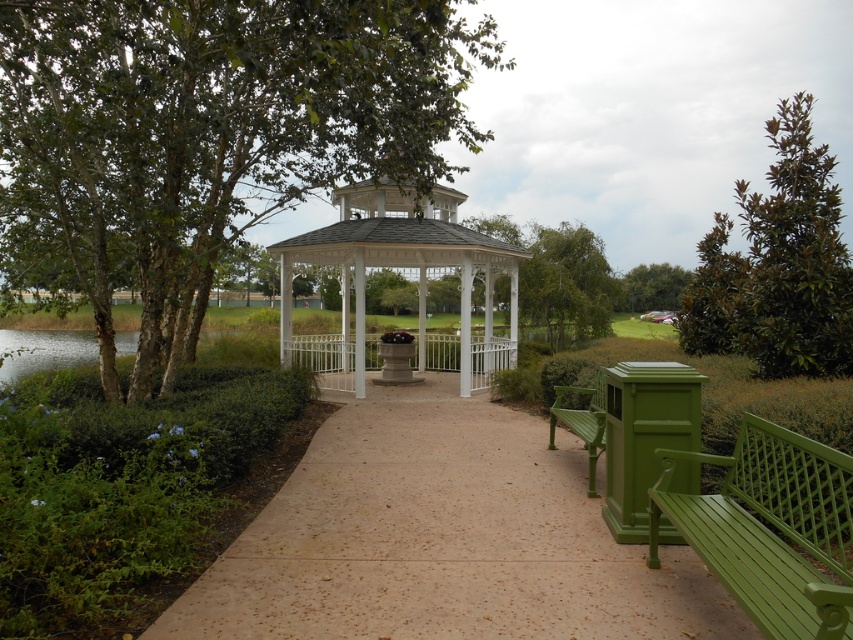
You are a park visitor standing at the entrance of the park. You see the white painted metal gazebo at center and the green leafy tree at center. Which object is positioned higher in the image?

The white painted metal gazebo at center is positioned higher than the green leafy tree at center in the image.

You are standing at the entrance of the park and see the green leafy tree at upper left and the green leafy tree at center. Which tree is closer to you?

The green leafy tree at upper left is closer to you because it is in front of the green leafy tree at center.

You are standing at the entrance of the park and see the white painted metal gazebo at center and the green leafy tree at center. Which object is closer to you?

The white painted metal gazebo at center is closer to the viewer than the green leafy tree at center.